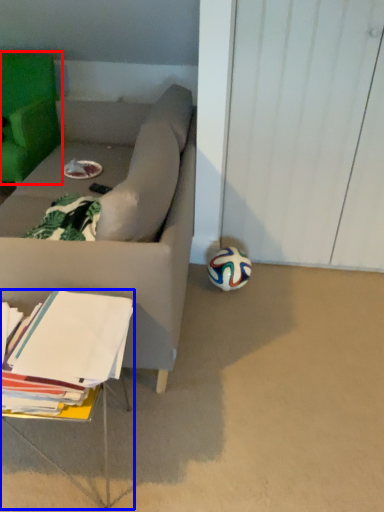
Question: Which point is closer to the camera, chair (highlighted by a red box) or table (highlighted by a blue box)?

Choices:
 (A) chair
 (B) table

Answer: (B)